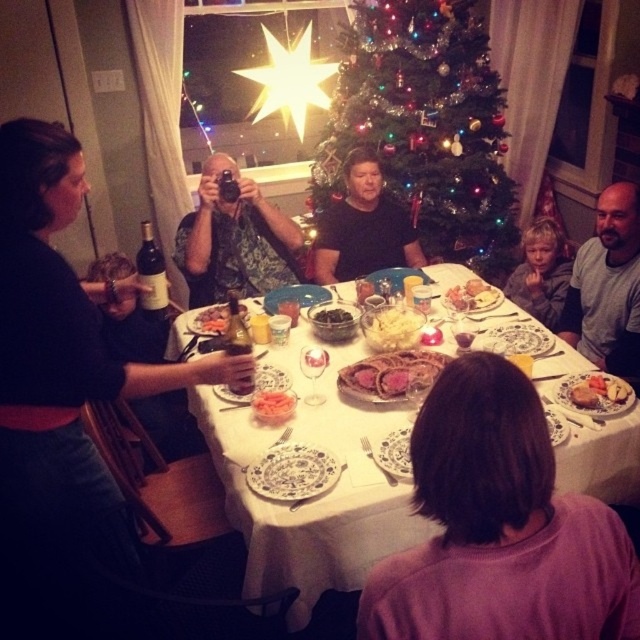
Can you confirm if green glittering christmas tree at center is bigger than white glossy table at center?

Yes, green glittering christmas tree at center is bigger than white glossy table at center.

Is point (472, 214) farther from viewer compared to point (225, 429)?

That is True.

Is point (404, 99) closer to camera compared to point (563, 440)?

No.

You are a GUI agent. You are given a task and a screenshot of the screen. Output one action in this format:
    pyautogui.click(x=<x>, y=<y>)
    Task: Click on the green glittering christmas tree at center
    The width and height of the screenshot is (640, 640).
    Given the screenshot: What is the action you would take?
    pyautogui.click(x=422, y=129)

Which of these two, purple sweater at lower center or green glittering christmas tree at center, stands shorter?

Standing shorter between the two is purple sweater at lower center.

Is purple sweater at lower center positioned behind green glittering christmas tree at center?

No, purple sweater at lower center is in front of green glittering christmas tree at center.

Between point (369, 596) and point (497, 97), which one is positioned in front?

Positioned in front is point (369, 596).

Image resolution: width=640 pixels, height=640 pixels. Identify the location of purple sweater at lower center. (499, 528).

Is golden brown crusty bread at center bigger than golden crispy pastry at center?

Indeed, golden brown crusty bread at center has a larger size compared to golden crispy pastry at center.

Can you confirm if golden brown crusty bread at center is positioned to the right of golden crispy pastry at center?

No, golden brown crusty bread at center is not to the right of golden crispy pastry at center.

Identify the location of golden brown crusty bread at center. (390, 372).

Locate an element on the screen. golden brown crusty bread at center is located at coordinates (390, 372).